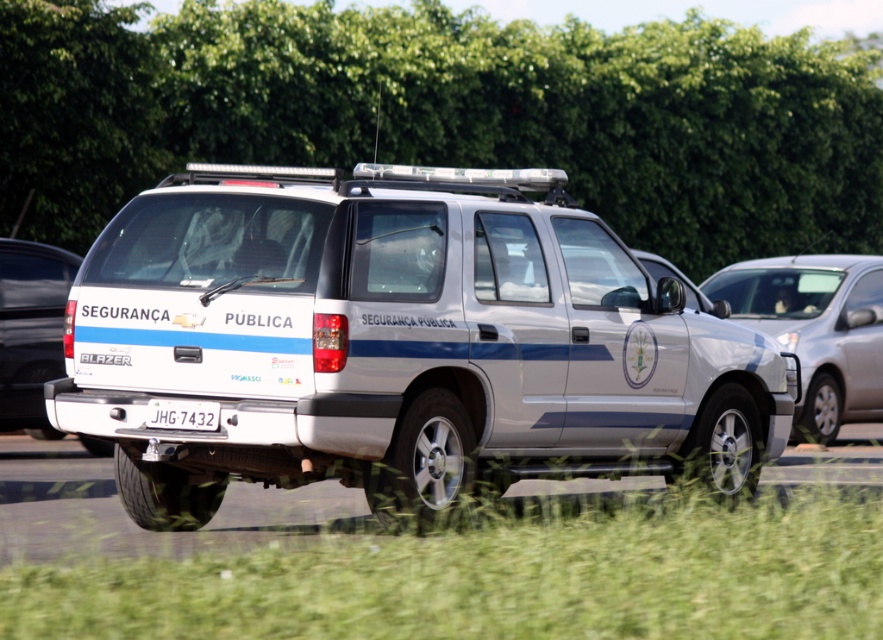
Consider the image. You are a driver approaching the white glossy suv at right and need to read the white plastic license plate at center. Is the license plate visible from your current position in front of the suv?

The white plastic license plate at center is behind the white glossy suv at right, so it is not visible from in front of the suv.